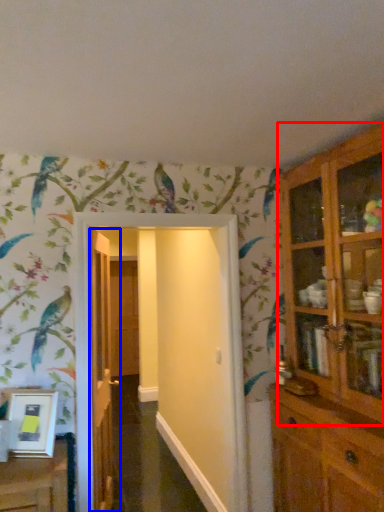
Question: Which object appears farthest to the camera in this image, cupboard (highlighted by a red box) or door (highlighted by a blue box)?

Choices:
 (A) cupboard
 (B) door

Answer: (B)